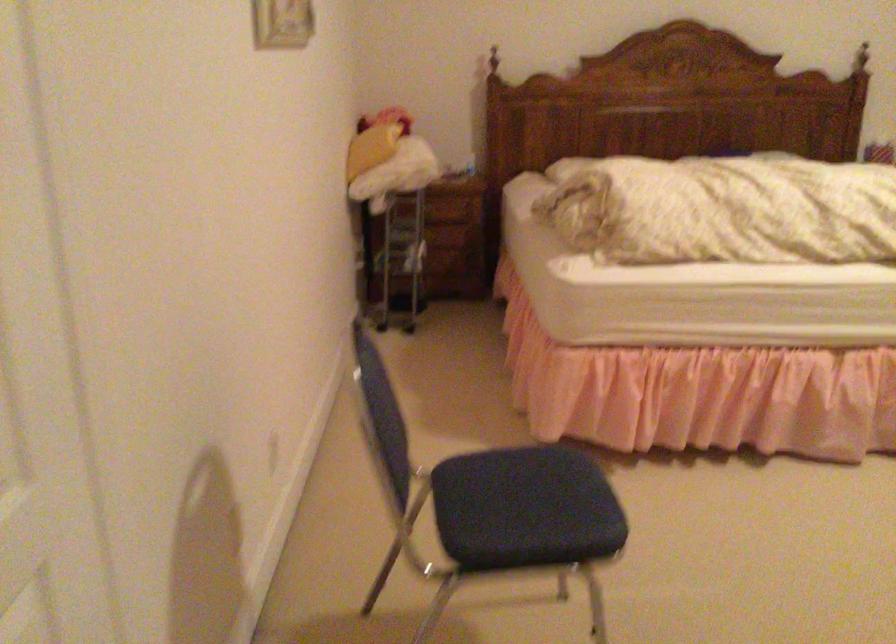
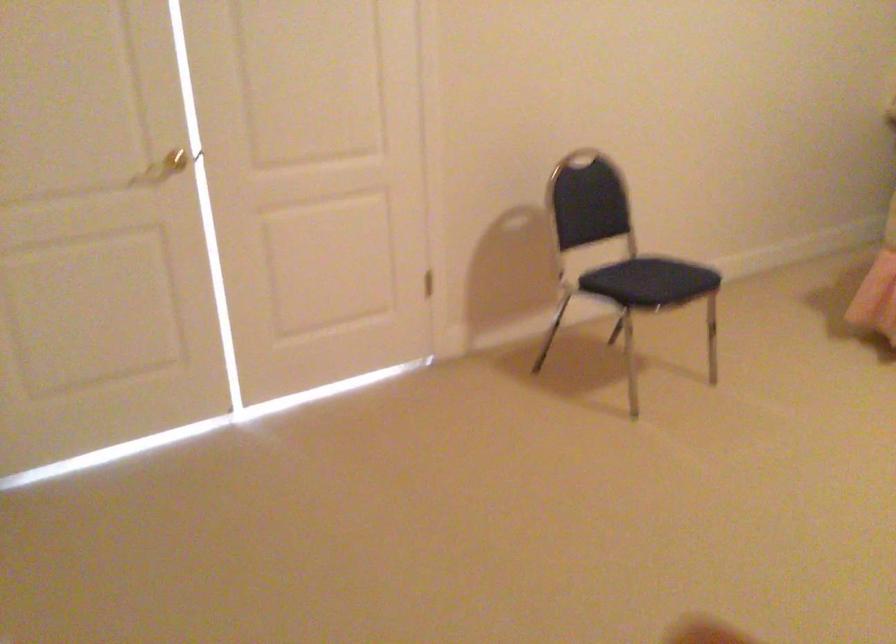
Find the pixel in the second image that matches point (554, 489) in the first image.

(657, 276)